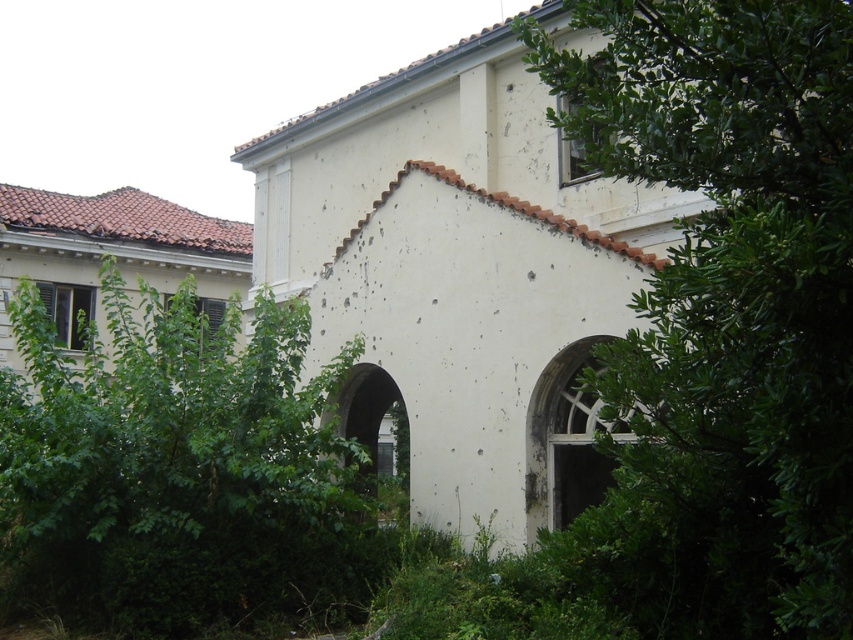
You are standing in front of the old building and notice a point marked at coordinates (x=724, y=314). Based on the scene description, can you determine what object this point is located on?

The point at coordinates (x=724, y=314) is on the green leafy tree at center right.

You are standing in front of the old building and want to determine the relative positions of two points marked on the facade. Which point, point (814, 353) or point (376, 410), is closer to your current position?

Point (814, 353) is closer to the camera than point (376, 410), so it is closer to your current position.